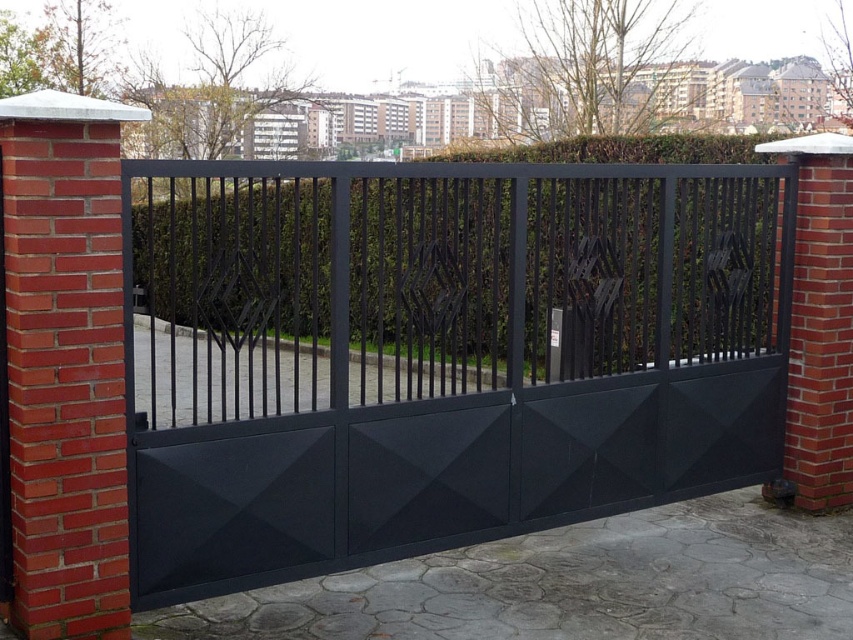
In the scene shown: Is matte black gate at center taller than green leafy hedge at center?

Indeed, matte black gate at center has a greater height compared to green leafy hedge at center.

Is point (312, 310) closer to camera compared to point (675, 337)?

No, it is not.

Identify the location of matte black gate at center. This screenshot has height=640, width=853. (438, 355).